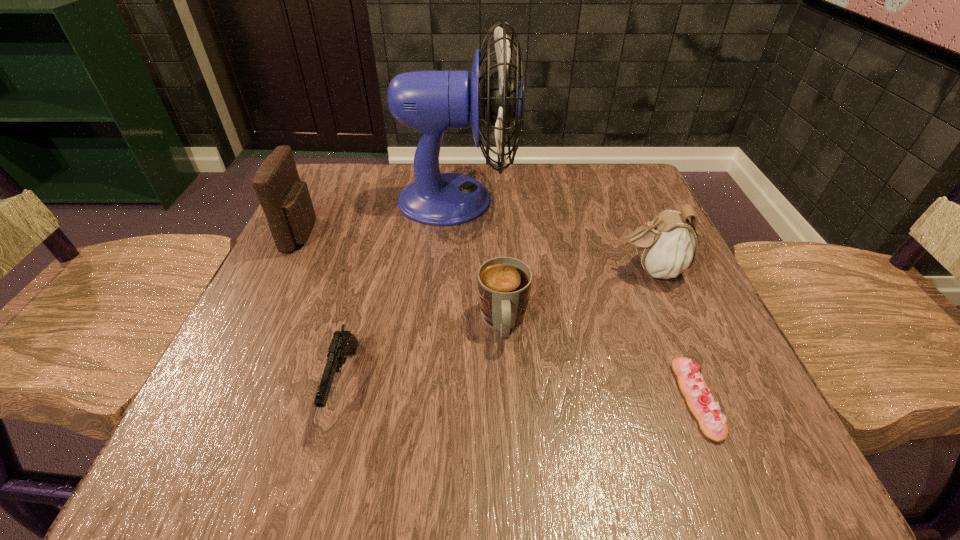
You are a GUI agent. You are given a task and a screenshot of the screen. Output one action in this format:
    pyautogui.click(x=<x>, y=<y>)
    Task: Click on the vacant area that satisfies the following two spatial constraints: 1. on the side of the mug with the handle; 2. on the right side of the shortest object
    The image size is (960, 540).
    Given the screenshot: What is the action you would take?
    pyautogui.click(x=507, y=399)